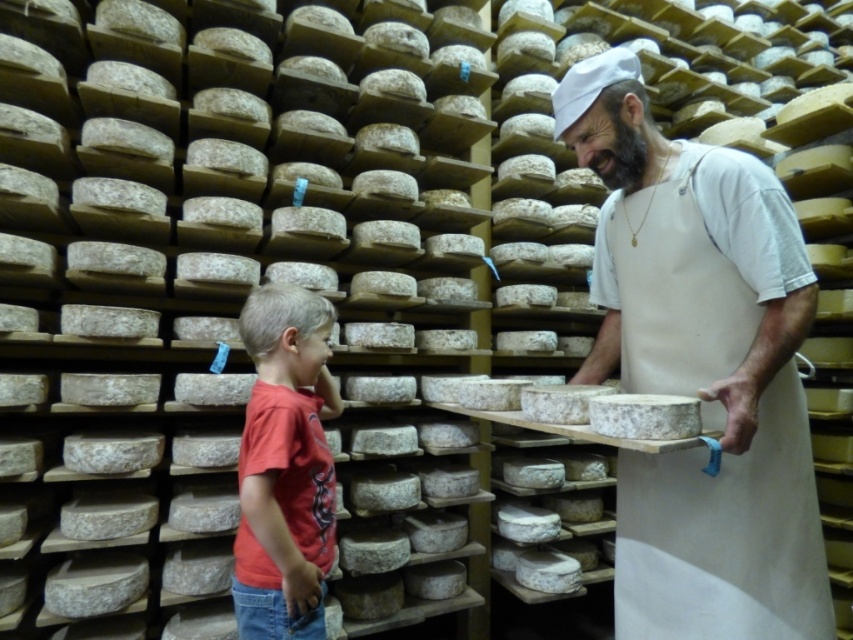
Consider the image. Is smooth white cheese at center behind red cotton shirt at lower left?

No, smooth white cheese at center is closer to the viewer.

You are a GUI agent. You are given a task and a screenshot of the screen. Output one action in this format:
    pyautogui.click(x=<x>, y=<y>)
    Task: Click on the smooth white cheese at center
    This screenshot has height=640, width=853.
    Given the screenshot: What is the action you would take?
    coord(700,369)